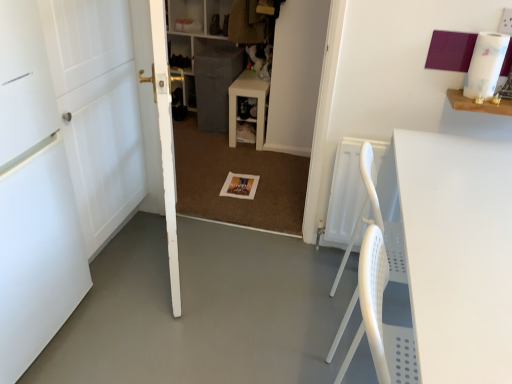
Where is `vacant space that is to the left of matte white table at center, which is counted as the 1th table, starting from the back`? vacant space that is to the left of matte white table at center, which is counted as the 1th table, starting from the back is located at coordinates (196, 138).